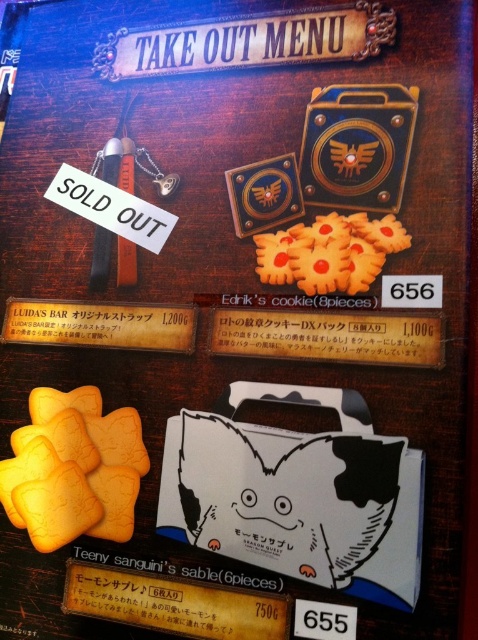
Question: Can you confirm if matte white paper at lower center is positioned below wooden sign at center?

Choices:
 (A) no
 (B) yes

Answer: (B)

Question: Which of the following is the closest to the observer?

Choices:
 (A) pos(343,340)
 (B) pos(170,625)

Answer: (B)

Question: Which of the following is the farthest from the observer?

Choices:
 (A) (192, 598)
 (B) (397, 353)
 (C) (63, 520)

Answer: (C)

Question: Is matte white paper at lower center in front of wooden sign at center?

Choices:
 (A) no
 (B) yes

Answer: (B)

Question: From the image, what is the correct spatial relationship of yellow matte biscuit at center in relation to matte gold cookie at center?

Choices:
 (A) above
 (B) below

Answer: (B)

Question: Estimate the real-world distances between objects in this image. Which object is closer to the matte white paper at lower center?

Choices:
 (A) yellow matte biscuit at center
 (B) matte gold cookie at center

Answer: (A)